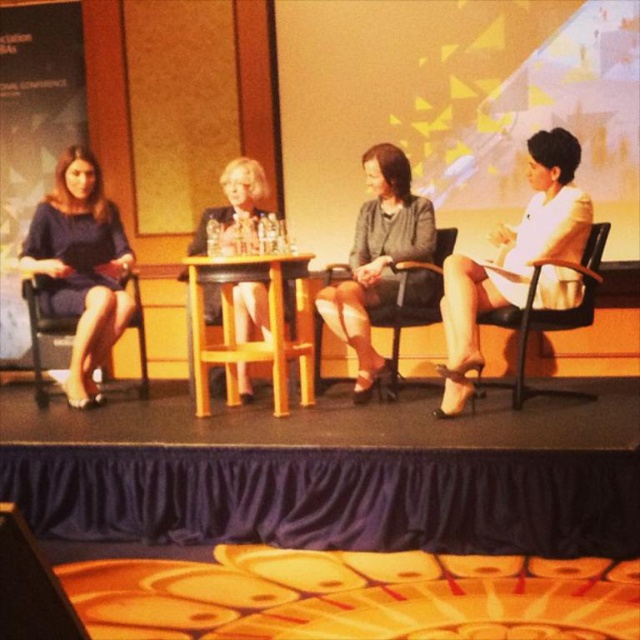
You are sitting in the wooden chair at left and want to hand a document to the person sitting in the black leather chair at right. Which direction should you move to reach them?

The black leather chair at right is in front of the wooden chair at left, so you should move forward to reach the person sitting in the black leather chair at right.

You are sitting in the wooden chair at left and want to pass a document to the person in the black leather chair at right. Which direction should you move to hand it to them?

Since the black leather chair at right is to the right of the wooden chair at left, you should move to your right to hand the document to the person in the black leather chair at right.

You are an audience member sitting in the front row of the panel discussion. You notice the wooden table at center and the matte black dress at center. Which object is positioned further to the left?

The matte black dress at center is positioned further to the left than the wooden table at center because the wooden table at center is to the right of matte black dress at center.